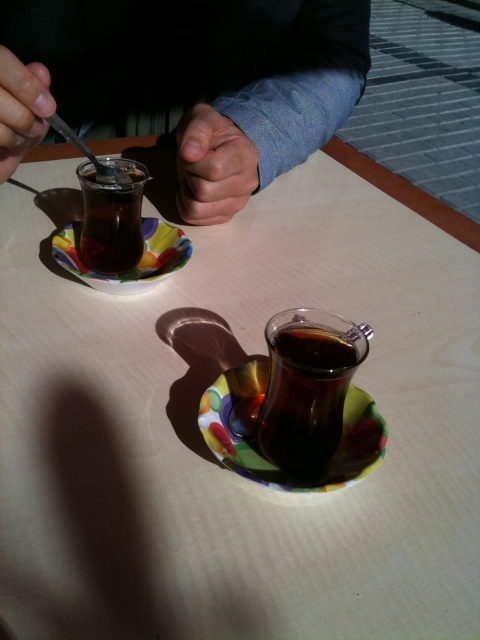
You are a photographer standing at the edge of the table. You want to capture a closeup of the matte glass cup at upper center without moving any objects. Given that your camera can focus on objects within 12 inches, will you be able to take the photo from your current position?

The matte glass cup at upper center is 11.83 inches from the viewer, which is within the camera focus range of 12 inches. Therefore, you can take the photo from your current position.